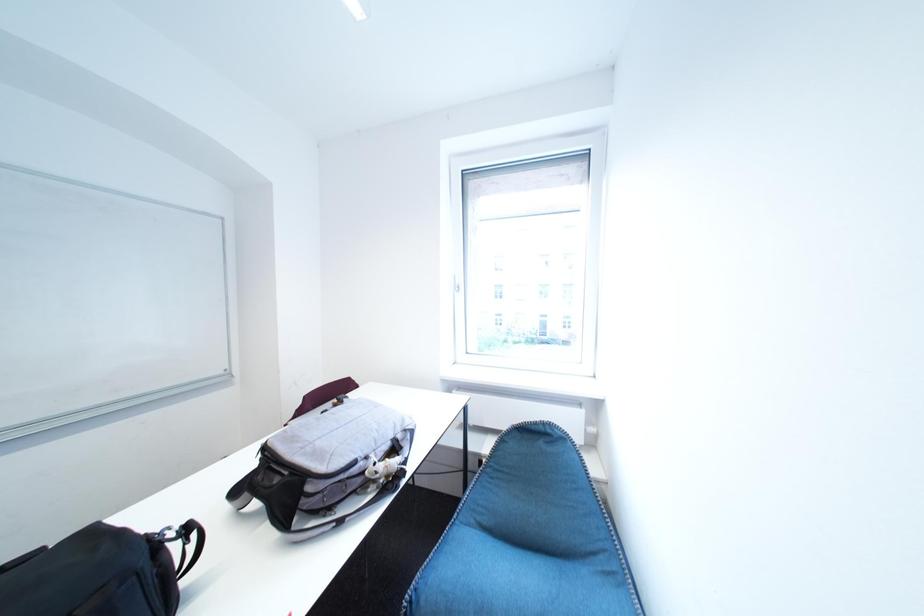
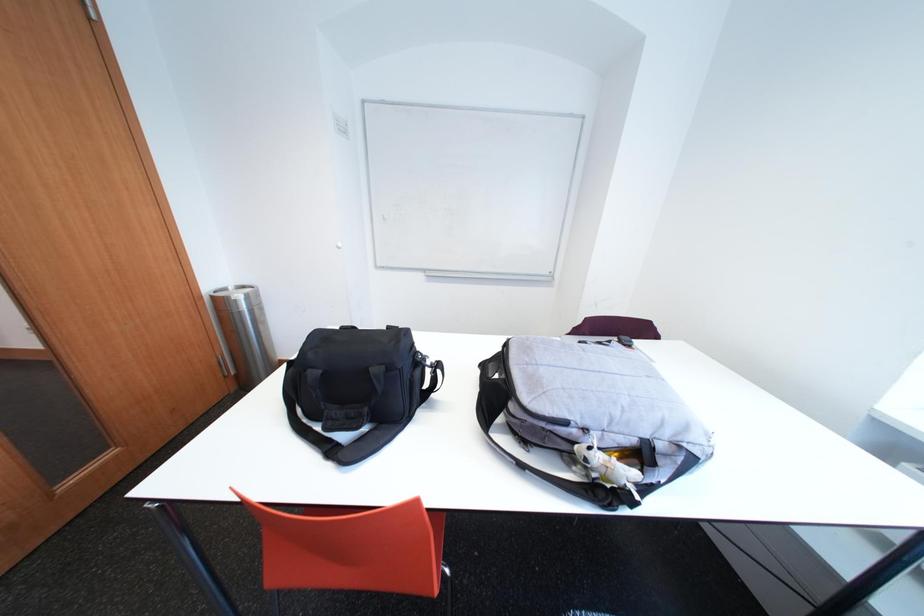
Looking at this image, based on the continuous images, in which direction is the camera rotating?

The rotation direction of the camera is left-down.